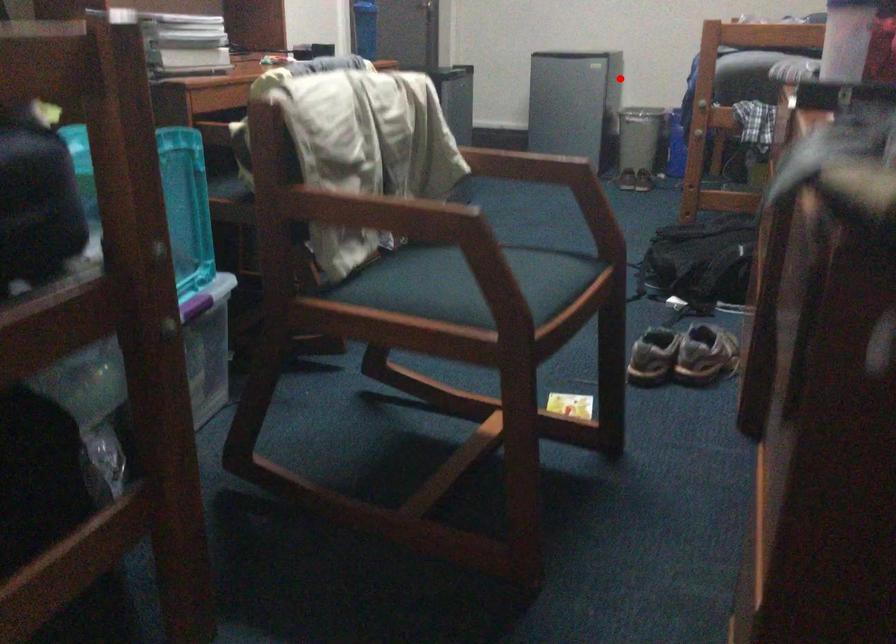
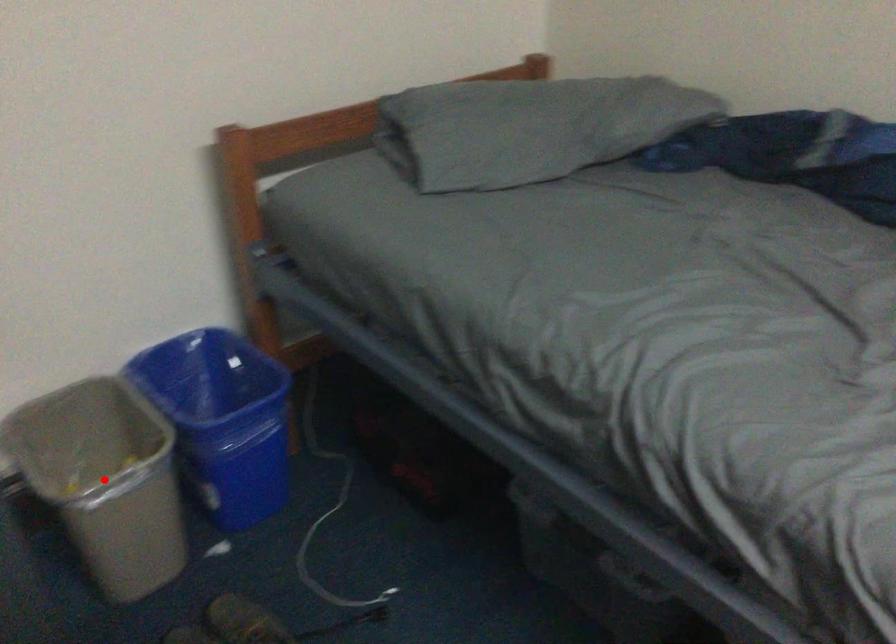
I am providing you with two images of the same scene from different viewpoints. A red point is marked on the first image and another point is marked on the second image. Is the marked point in image1 the same physical position as the marked point in image2?

Yes